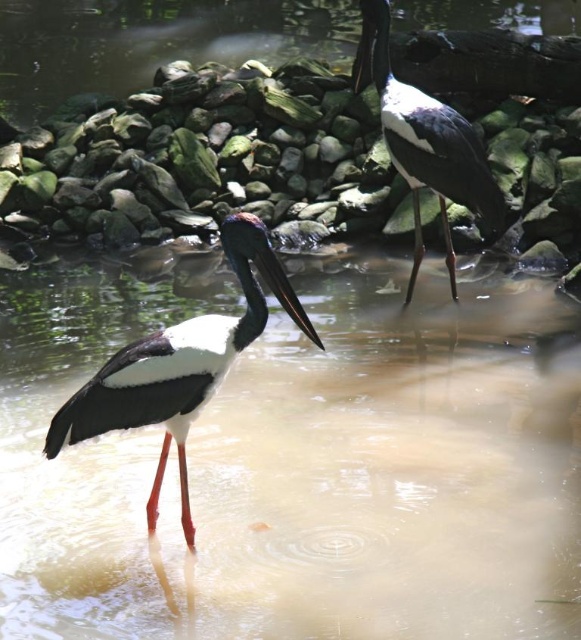
You are a birdwatcher observing two black glossy storks in the water. You notice the black glossy stork at center and the black glossy stork at upper right. Which stork appears taller in the image?

The black glossy stork at upper right appears taller than the black glossy stork at center because the description states that the stork at center is not as tall as the one at upper right.

You are a birdwatcher observing the two black glossy storks in the image. Which stork is positioned lower in the frame, the black glossy stork at center or the black glossy stork at upper right?

The black glossy stork at center is located below the black glossy stork at upper right, so the stork at center is positioned lower in the frame.

You are a birdwatcher observing the scene. You notice a point marked at coordinates (302, 467). What is the location of this point relative to the storks?

The point at (302, 467) is located on the translucent muddy water at center, which is between the two storks since the foreground stork is at the front and the background stork is further back.